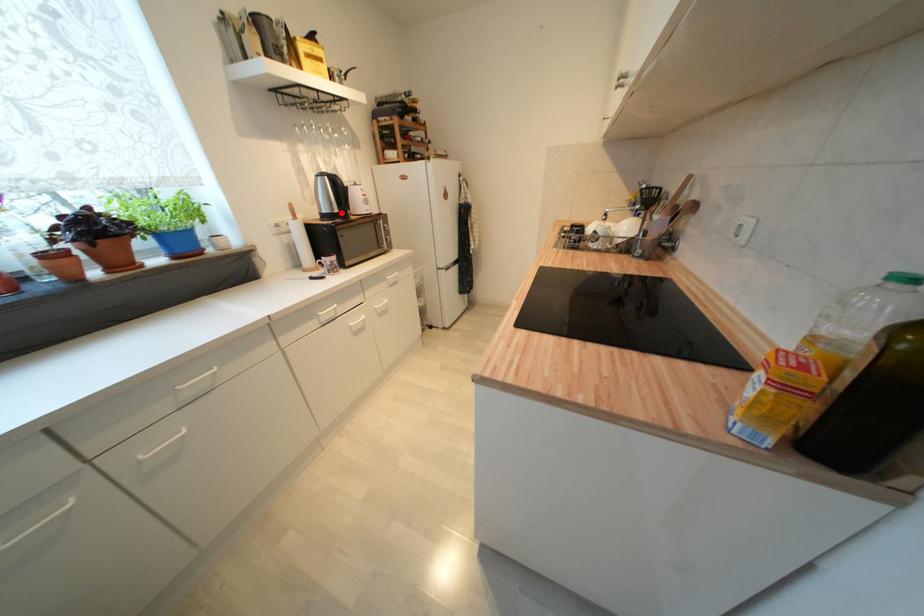
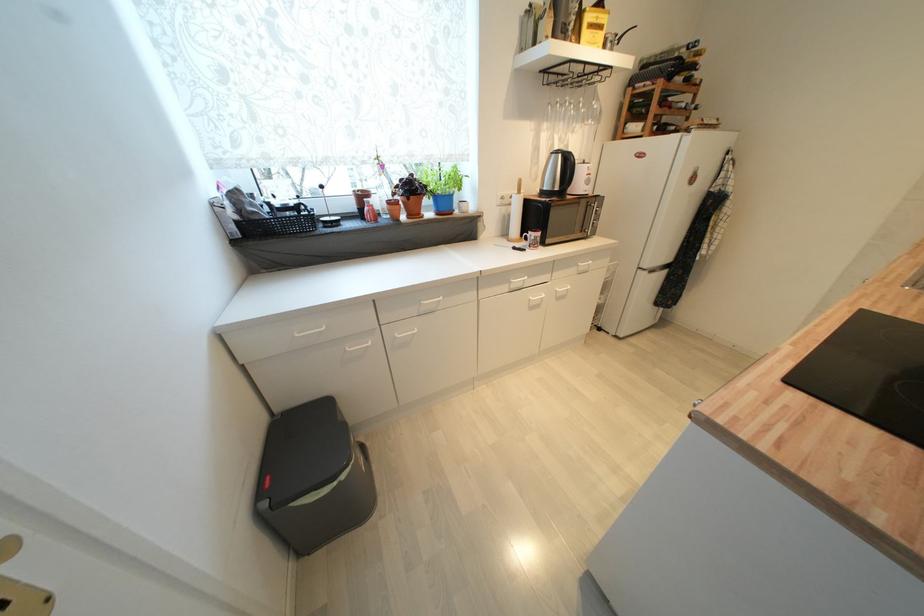
Locate, in the second image, the point that corresponds to the highlighted location in the first image.

(562, 191)